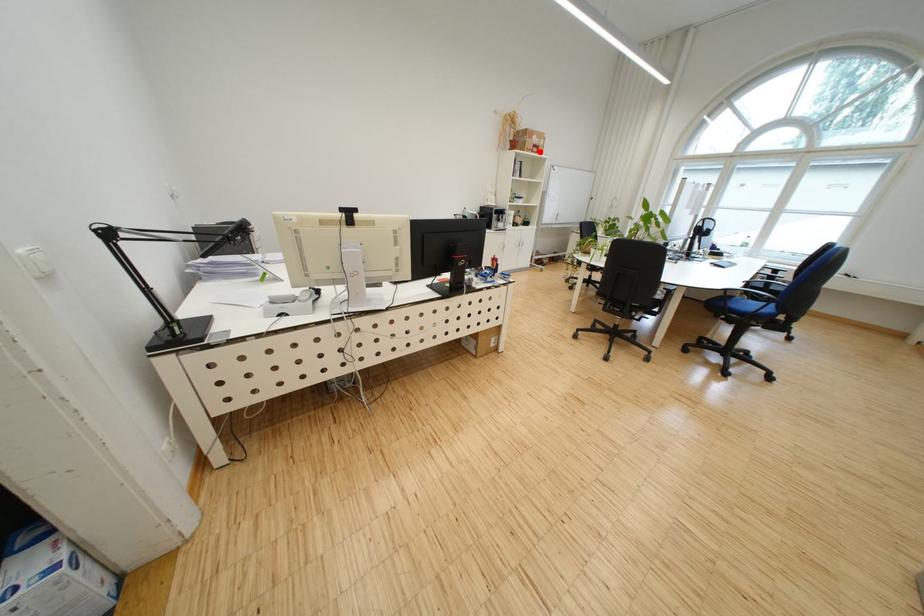
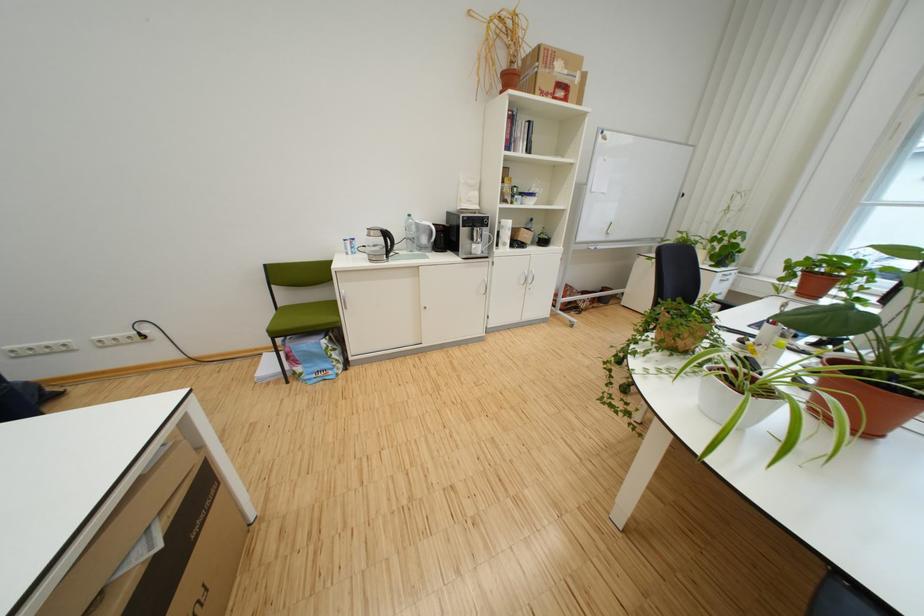
Find the pixel in the second image that matches the highlighted location in the first image.

(553, 95)